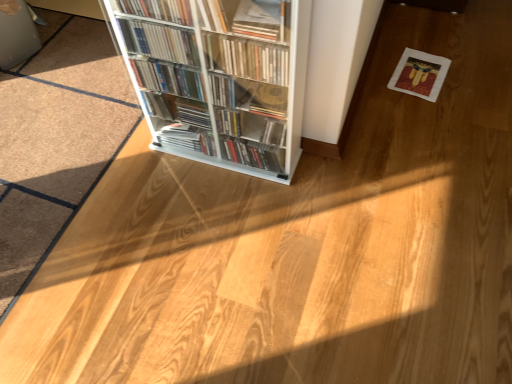
Locate an element on the screen. The width and height of the screenshot is (512, 384). white glossy bookcase at center is located at coordinates (219, 78).

The width and height of the screenshot is (512, 384). What do you see at coordinates (219, 78) in the screenshot? I see `white glossy bookcase at center` at bounding box center [219, 78].

At what (x,y) coordinates should I click in order to perform the action: click on white glossy bookcase at center. Please return your answer as a coordinate pair (x, y). Image resolution: width=512 pixels, height=384 pixels. Looking at the image, I should click on (219, 78).